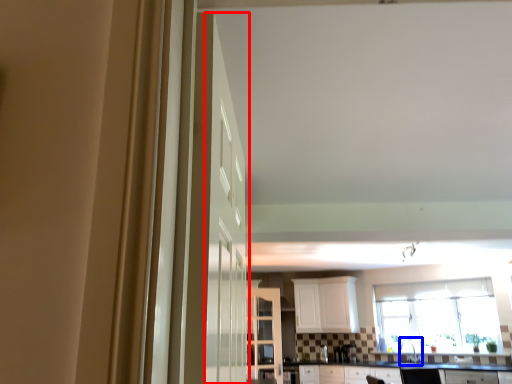
Question: Which object is further to the camera taking this photo, door (highlighted by a red box) or sink (highlighted by a blue box)?

Choices:
 (A) door
 (B) sink

Answer: (B)